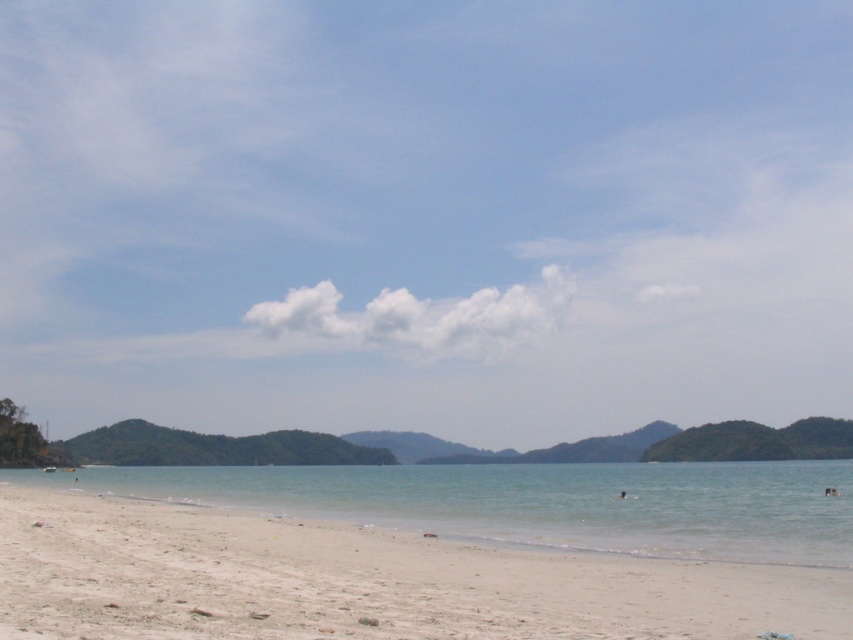
Question: Where is clear water at beach center located in relation to brown skin at lower center in the image?

Choices:
 (A) above
 (B) below

Answer: (B)

Question: Among these objects, which one is nearest to the camera?

Choices:
 (A) white sandy beach at lower left
 (B) clear water at beach center
 (C) brown skin at lower center

Answer: (A)

Question: Among these objects, which one is farthest from the camera?

Choices:
 (A) white sandy beach at lower left
 (B) brown skin at lower center

Answer: (B)

Question: Which of the following is the farthest from the observer?

Choices:
 (A) clear water at beach center
 (B) brown skin at lower center
 (C) white sandy beach at lower left

Answer: (B)

Question: Does white sandy beach at lower left come in front of brown skin at lower center?

Choices:
 (A) yes
 (B) no

Answer: (A)

Question: Is white sandy beach at lower left to the right of clear water at beach center from the viewer's perspective?

Choices:
 (A) no
 (B) yes

Answer: (A)